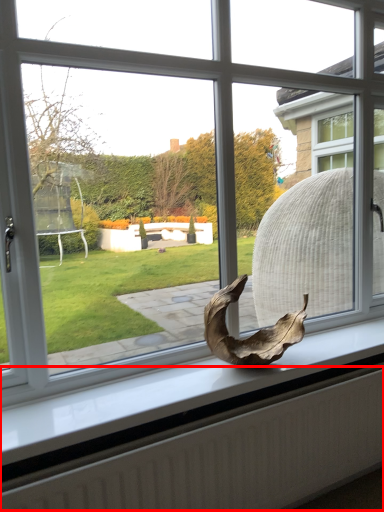
Question: From the image's perspective, where is radiator (annotated by the red box) located relative to animal?

Choices:
 (A) above
 (B) below

Answer: (B)